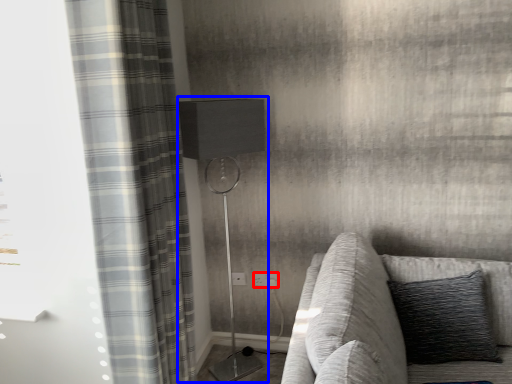
Question: Which point is closer to the camera, electric outlet (highlighted by a red box) or table lamp (highlighted by a blue box)?

Choices:
 (A) electric outlet
 (B) table lamp

Answer: (B)